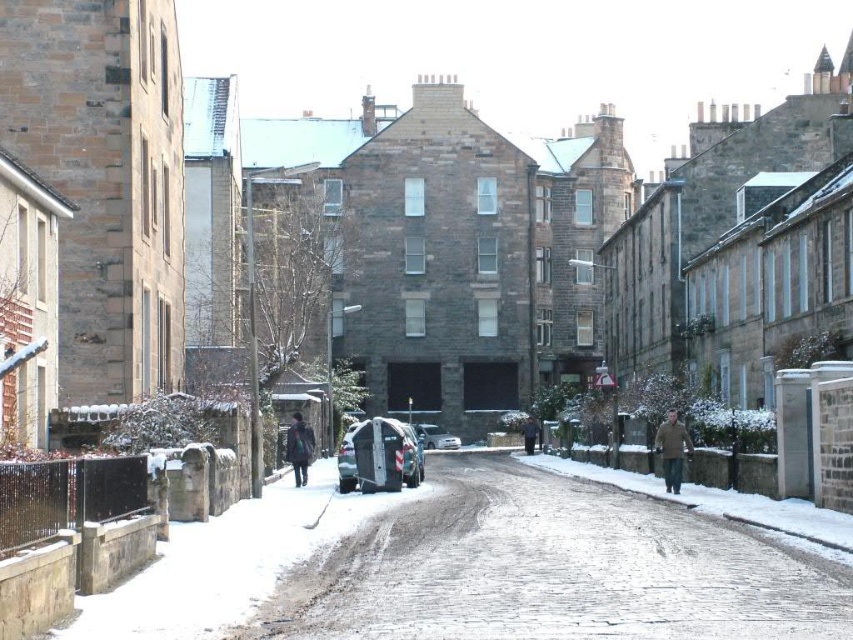
Is point (494, 616) positioned before point (672, 429)?

Yes.

Which is behind, point (843, 612) or point (657, 442)?

Positioned behind is point (657, 442).

Image resolution: width=853 pixels, height=640 pixels. Find the location of `snowy cobblestone road at center`. snowy cobblestone road at center is located at coordinates (550, 570).

Can you confirm if dark brown leather jacket at center is shorter than silver metallic car at center?

In fact, dark brown leather jacket at center may be taller than silver metallic car at center.

Which is below, dark brown leather jacket at center or silver metallic car at center?

Positioned lower is silver metallic car at center.

What do you see at coordinates (299, 448) in the screenshot? The width and height of the screenshot is (853, 640). I see `dark brown leather jacket at center` at bounding box center [299, 448].

Image resolution: width=853 pixels, height=640 pixels. What are the coordinates of `dark brown leather jacket at center` in the screenshot? It's located at (299, 448).

Who is lower down, snowy cobblestone road at center or silver metallic car at center?

silver metallic car at center

Between snowy cobblestone road at center and silver metallic car at center, which one appears on the right side from the viewer's perspective?

From the viewer's perspective, snowy cobblestone road at center appears more on the right side.

Between point (549, 620) and point (454, 448), which one is positioned in front?

Point (549, 620) is more forward.

Locate an element on the screen. snowy cobblestone road at center is located at coordinates (550, 570).